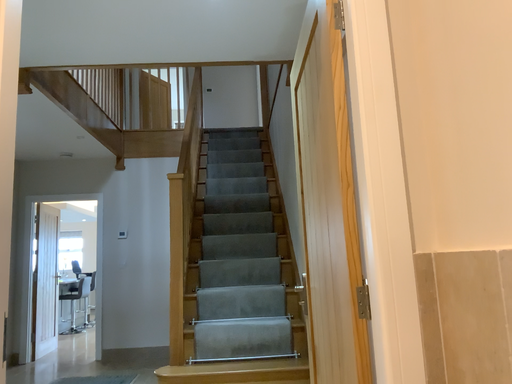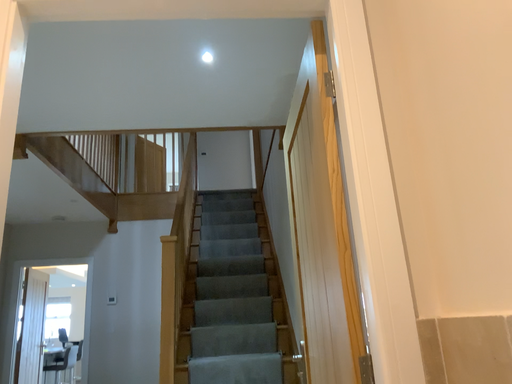
Question: How did the camera likely rotate when shooting the video?

Choices:
 (A) rotated downward
 (B) rotated upward

Answer: (B)